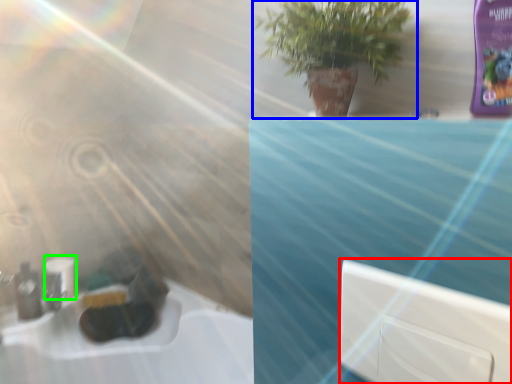
Question: Based on their relative distances, which object is farther from window (highlighted by a red box)? Choose from houseplant (highlighted by a blue box) and toilet paper (highlighted by a green box).

Choices:
 (A) houseplant
 (B) toilet paper

Answer: (B)